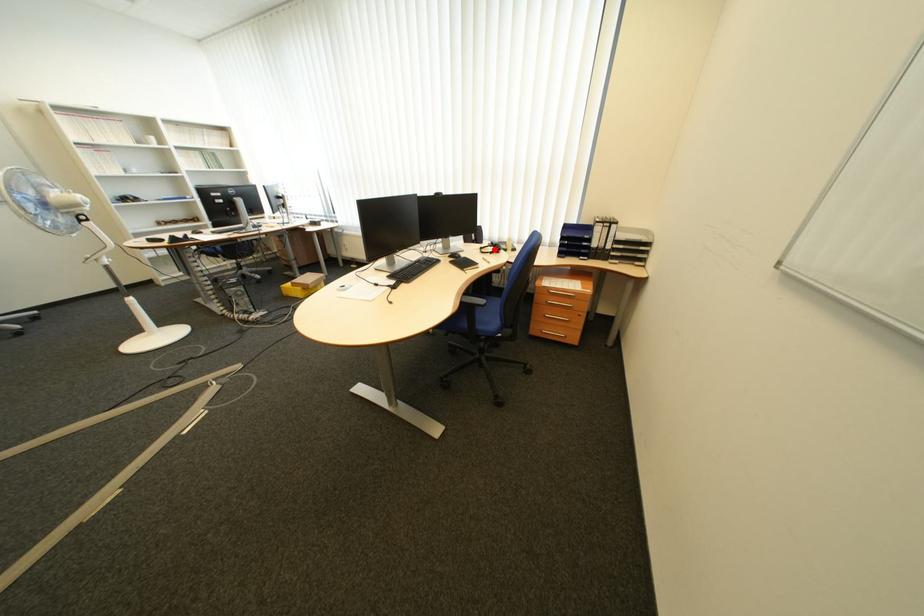
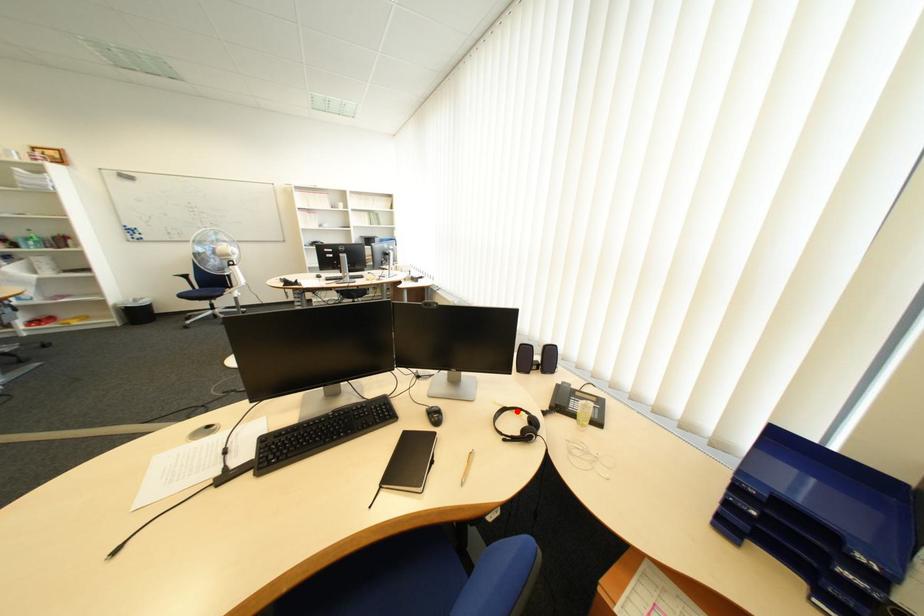
I am providing you with two images of the same scene from different viewpoints. A red point is marked on the first image and another point is marked on the second image. Does the point marked in image1 correspond to the same location as the one in image2?

Yes